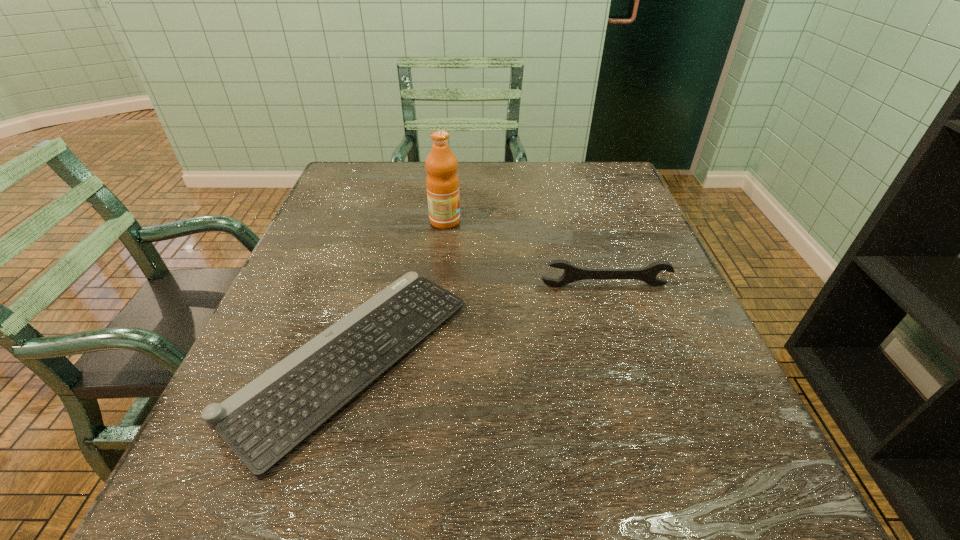
What are the coordinates of `object that is at the right edge` in the screenshot? It's located at coord(572,273).

In order to click on object that is positioned at the near left corner in this screenshot , I will do `click(264, 421)`.

Locate an element on the screen. This screenshot has height=540, width=960. free space at the far edge is located at coordinates 409,176.

In order to click on free space at the left edge of the desktop in this screenshot , I will do `click(210, 449)`.

Identify the location of vacant region at the right edge of the desktop. (613, 261).

Image resolution: width=960 pixels, height=540 pixels. Identify the location of free region at the far right corner. (623, 188).

This screenshot has height=540, width=960. Identify the location of vacant space at the near right corner of the desktop. (721, 489).

The width and height of the screenshot is (960, 540). In order to click on free area in between the tallest object and the second tallest object in this screenshot , I will do `click(525, 254)`.

The height and width of the screenshot is (540, 960). In order to click on vacant space that's between the computer keyboard and the rightmost object in this screenshot , I will do `click(478, 322)`.

The width and height of the screenshot is (960, 540). I want to click on vacant space that is in between the farthest object and the wrench, so click(x=525, y=254).